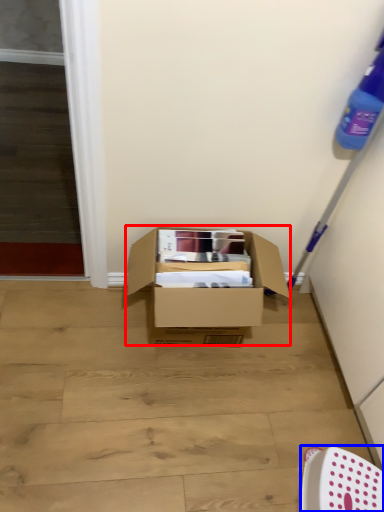
Question: Among these objects, which one is farthest to the camera, box (highlighted by a red box) or chair (highlighted by a blue box)?

Choices:
 (A) box
 (B) chair

Answer: (A)